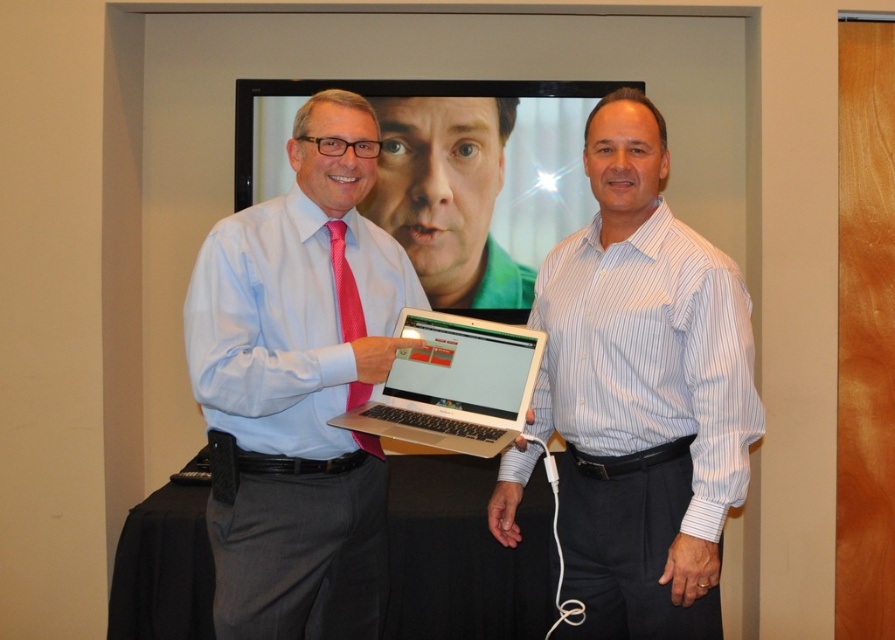
Question: Can you confirm if white striped shirt at center is positioned above pink satin tie at center?

Choices:
 (A) yes
 (B) no

Answer: (B)

Question: Estimate the real-world distances between objects in this image. Which object is farther from the matte pink tie at center?

Choices:
 (A) silver metallic laptop at center
 (B) pink satin tie at center
 (C) white striped shirt at center

Answer: (C)

Question: Among these objects, which one is nearest to the camera?

Choices:
 (A) white striped shirt at center
 (B) matte pink tie at center
 (C) pink satin tie at center
 (D) silver metallic laptop at center

Answer: (D)

Question: Does matte pink tie at center appear over pink satin tie at center?

Choices:
 (A) no
 (B) yes

Answer: (A)

Question: Does white striped shirt at center have a smaller size compared to pink satin tie at center?

Choices:
 (A) yes
 (B) no

Answer: (B)

Question: Which object is the farthest from the white striped shirt at center?

Choices:
 (A) pink satin tie at center
 (B) silver metallic laptop at center

Answer: (A)